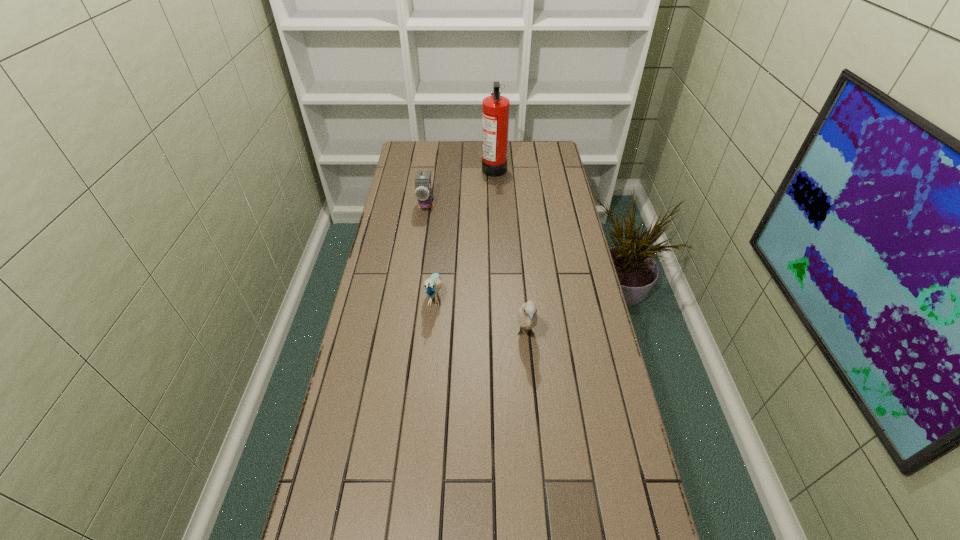
The height and width of the screenshot is (540, 960). I want to click on vacant space situated at the beak of the second farthest object, so click(x=423, y=228).

This screenshot has height=540, width=960. I want to click on free region located at the face of the second object from left to right, so click(426, 378).

This screenshot has width=960, height=540. Identify the location of object at the far edge. (495, 109).

Identify the location of object located at the left edge. The image size is (960, 540). (423, 194).

Identify the location of free space at the far edge of the desktop. (437, 148).

Locate an element on the screen. vacant region at the left edge of the desktop is located at coordinates (402, 193).

I want to click on vacant space at the right edge of the desktop, so click(x=597, y=308).

What are the coordinates of `vacant space at the far left corner of the desktop` in the screenshot? It's located at (416, 157).

Find the location of `vacant space at the far right corner of the desktop`. vacant space at the far right corner of the desktop is located at coordinates (553, 152).

This screenshot has width=960, height=540. Identify the location of free spot between the leftmost bird and the rightmost bird. (476, 269).